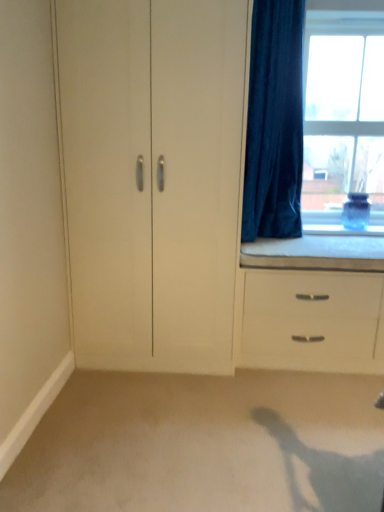
I want to click on vacant area on top of white foam cushion at window (from a real-world perspective), so 335,234.